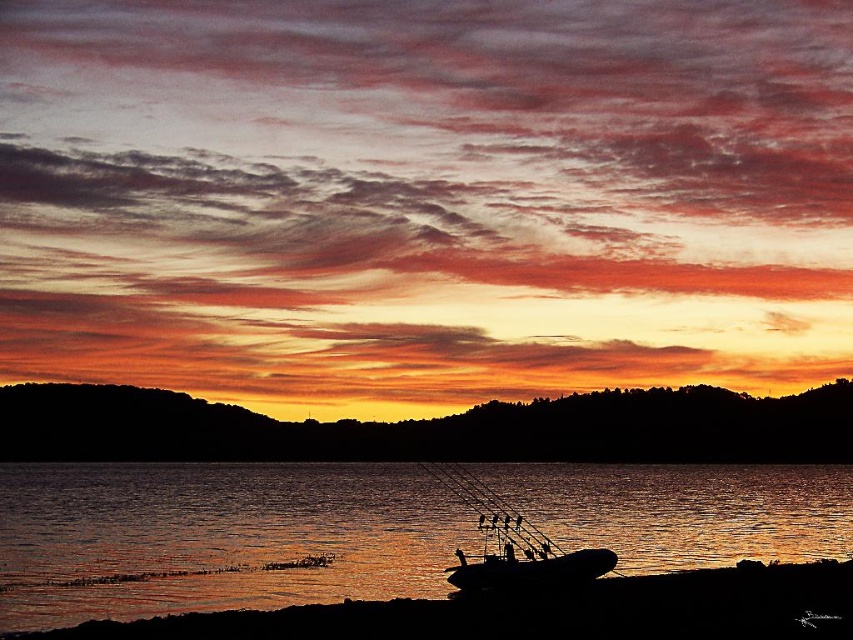
You are standing at the point with coordinates point (601, 568) and want to move towards the boat in the foreground. Is the point point (602, 509) located behind you or in front of you relative to your direction of movement?

The point point (602, 509) is behind point (601, 568), so if you are moving towards the boat in the foreground, the point point (602, 509) would be behind you relative to your direction of movement.

You are standing on the smooth sand at lower center and want to board the black matte boat at lower center. Which direction should you walk to reach the boat?

The smooth sand at lower center is positioned on the right side of the black matte boat at lower center, so you should walk to the left to reach the boat.

You are standing on the smooth sand at lower center and want to board the black matte boat at lower center. Is the sand wide enough to walk to the boat without stepping into water?

The smooth sand at lower center might be wider than black matte boat at lower center, so there is a possibility that the sand extends sufficiently to allow walking to the boat without entering water. However, the exact width isn